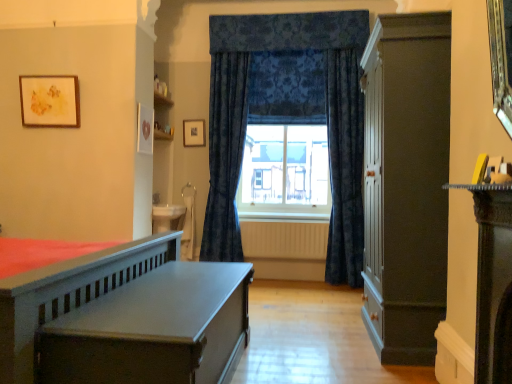
Question: Is white textured radiator at center completely or partially outside of velvet dark blue curtain at center, which is the 2th curtain in left-to-right order?

Choices:
 (A) no
 (B) yes

Answer: (B)

Question: Is white textured radiator at center oriented away from velvet dark blue curtain at center, which is counted as the 1th curtain, starting from the right?

Choices:
 (A) yes
 (B) no

Answer: (B)

Question: Is white textured radiator at center next to velvet dark blue curtain at center, which is counted as the 1th curtain, starting from the right, and touching it?

Choices:
 (A) yes
 (B) no

Answer: (B)

Question: Is white textured radiator at center further to the viewer compared to velvet dark blue curtain at center, which is counted as the 1th curtain, starting from the right?

Choices:
 (A) no
 (B) yes

Answer: (B)

Question: Can you confirm if white textured radiator at center is positioned to the right of velvet dark blue curtain at center, which is counted as the 1th curtain, starting from the right?

Choices:
 (A) no
 (B) yes

Answer: (A)

Question: Considering the relative sizes of white textured radiator at center and velvet dark blue curtain at center, which is the 2th curtain in left-to-right order, in the image provided, is white textured radiator at center taller than velvet dark blue curtain at center, which is the 2th curtain in left-to-right order,?

Choices:
 (A) no
 (B) yes

Answer: (A)

Question: Is white textured radiator at center to the right of dark blue velvet curtains at center, acting as the first curtain starting from the left, from the viewer's perspective?

Choices:
 (A) no
 (B) yes

Answer: (B)

Question: From the image's perspective, is white textured radiator at center below dark blue velvet curtains at center, acting as the first curtain starting from the left?

Choices:
 (A) yes
 (B) no

Answer: (A)

Question: Considering the relative sizes of white textured radiator at center and dark blue velvet curtains at center, the second curtain viewed from the right, in the image provided, is white textured radiator at center wider than dark blue velvet curtains at center, the second curtain viewed from the right,?

Choices:
 (A) no
 (B) yes

Answer: (A)

Question: From the image's perspective, is white textured radiator at center above dark blue velvet curtains at center, acting as the first curtain starting from the left?

Choices:
 (A) no
 (B) yes

Answer: (A)

Question: From a real-world perspective, is white textured radiator at center positioned over dark blue velvet curtains at center, the second curtain viewed from the right, based on gravity?

Choices:
 (A) yes
 (B) no

Answer: (B)

Question: Would you consider white textured radiator at center to be distant from dark blue velvet curtains at center, the second curtain viewed from the right?

Choices:
 (A) no
 (B) yes

Answer: (A)

Question: Is matte gray wooden bed at left next to white textured radiator at center and touching it?

Choices:
 (A) yes
 (B) no

Answer: (B)